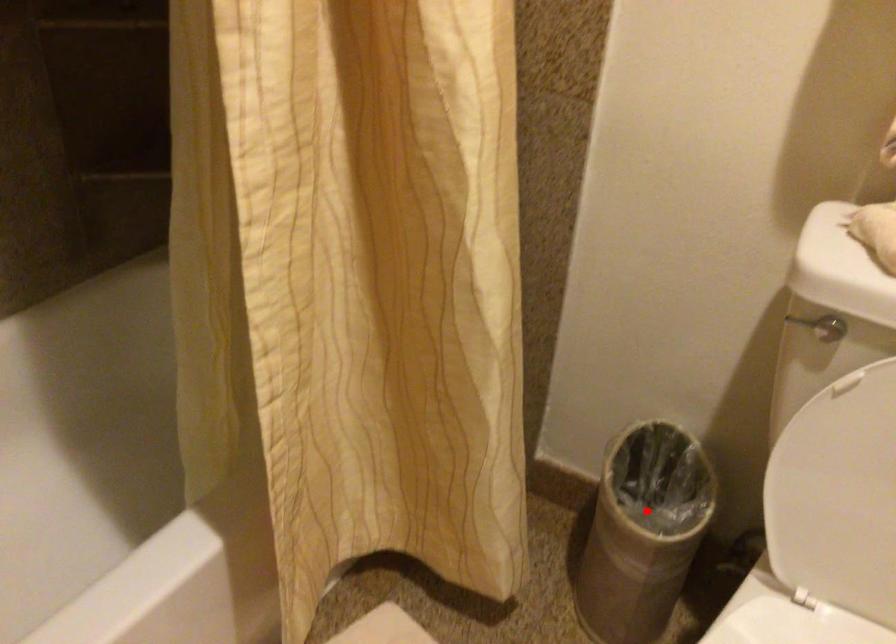
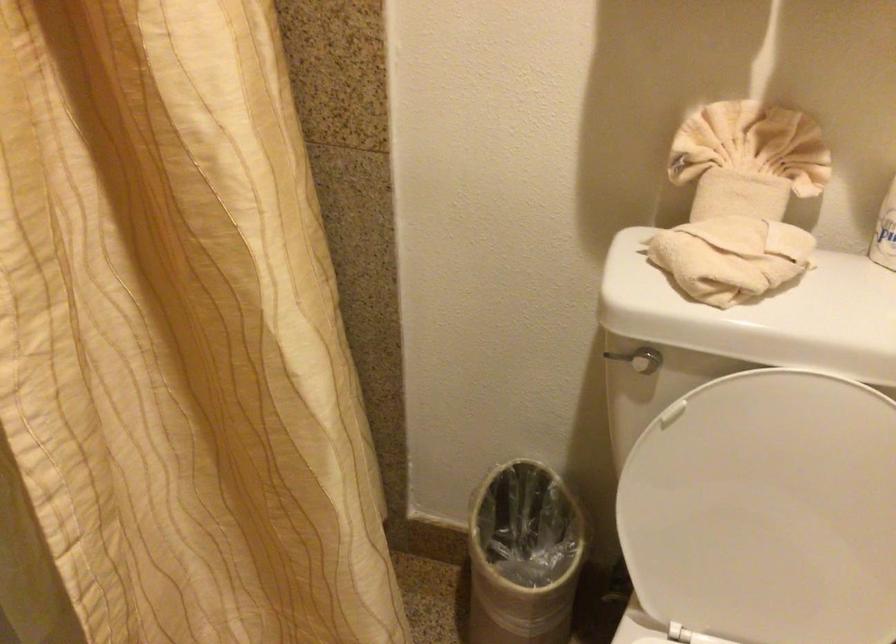
Question: A red point is marked in image1. In image2, is the corresponding 3D point closer to the camera or farther? Reply with the corresponding letter.

Choices:
 (A) The corresponding 3D point is closer.
 (B) The corresponding 3D point is farther.

Answer: (B)